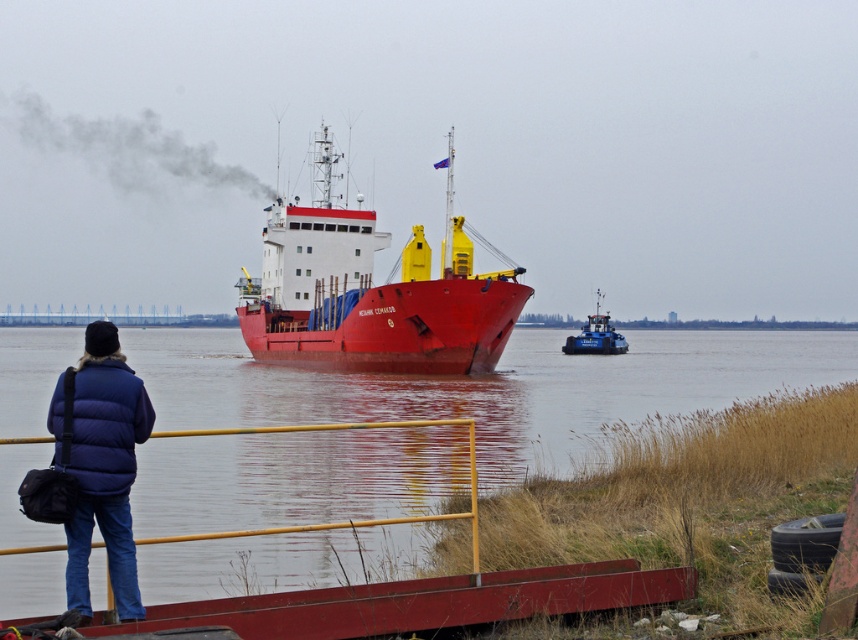
Does smooth water at ship front have a lesser width compared to yellow metal rail at lower center?

No.

Who is higher up, smooth water at ship front or yellow metal rail at lower center?

smooth water at ship front is above.

Between point (565, 384) and point (227, 538), which one is positioned behind?

The point (565, 384) is more distant.

You are a GUI agent. You are given a task and a screenshot of the screen. Output one action in this format:
    pyautogui.click(x=<x>, y=<y>)
    Task: Click on the smooth water at ship front
    Image resolution: width=858 pixels, height=640 pixels.
    Given the screenshot: What is the action you would take?
    point(488,385)

Who is positioned more to the right, yellow metal rail at lower center or blue metallic tugboat at center?

blue metallic tugboat at center

Is yellow metal rail at lower center below blue metallic tugboat at center?

Yes, yellow metal rail at lower center is below blue metallic tugboat at center.

Locate an element on the screen. yellow metal rail at lower center is located at coordinates (337, 522).

Find the location of a particular element. yellow metal rail at lower center is located at coordinates (337, 522).

Where is `red matte ship at center`? Image resolution: width=858 pixels, height=640 pixels. red matte ship at center is located at coordinates (372, 292).